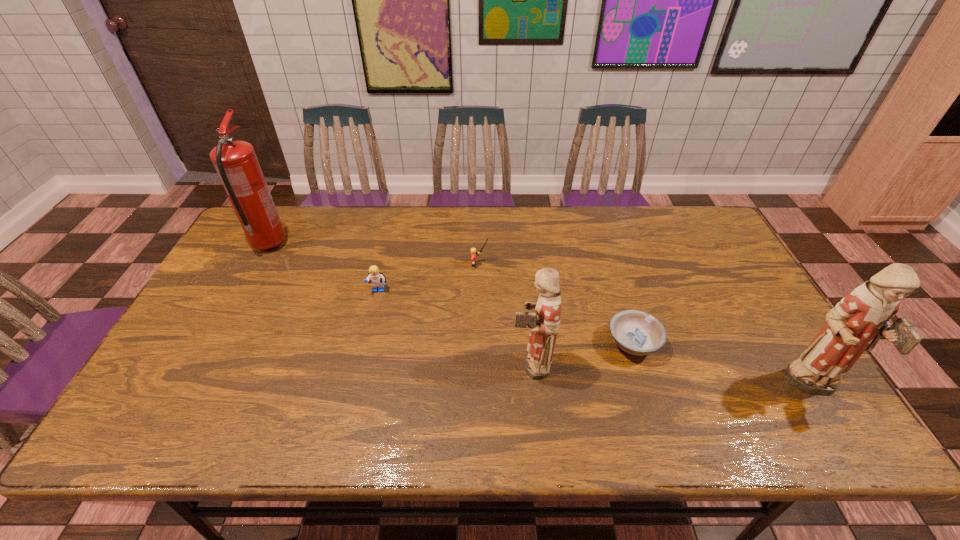
What are the coordinates of `the shorter figurine` in the screenshot? It's located at (543, 324).

At what (x,y) coordinates should I click in order to perform the action: click on the third tallest object. Please return your answer as a coordinate pair (x, y). Looking at the image, I should click on (543, 324).

Locate an element on the screen. Image resolution: width=960 pixels, height=540 pixels. the right figurine is located at coordinates (862, 317).

The height and width of the screenshot is (540, 960). In order to click on the rightmost object in this screenshot , I will do `click(862, 317)`.

Identify the location of the third farthest object. (377, 279).

At what (x,y) coordinates should I click in order to perform the action: click on the nearer Lego. Please return your answer as a coordinate pair (x, y). Looking at the image, I should click on (377, 279).

The width and height of the screenshot is (960, 540). I want to click on fire extinguisher, so click(x=235, y=161).

This screenshot has height=540, width=960. Identify the location of the farther Lego. (473, 250).

Where is `the third object from left to right`? the third object from left to right is located at coordinates (473, 250).

This screenshot has height=540, width=960. Identify the location of the shortest object. (635, 332).